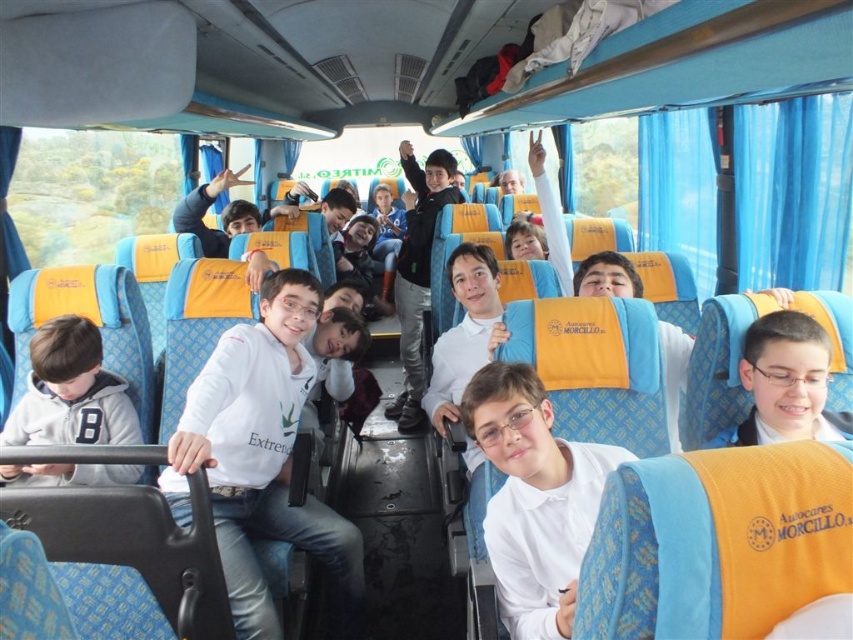
You are a photographer standing at the back of the bus. You want to take a clear photo of the white glossy shirt at center without moving any objects. Can you do it?

The white glossy shirt at center is 1.39 meters away from the camera, so yes, the photographer can take a clear photo of the white glossy shirt at center from that distance without needing to move any objects.